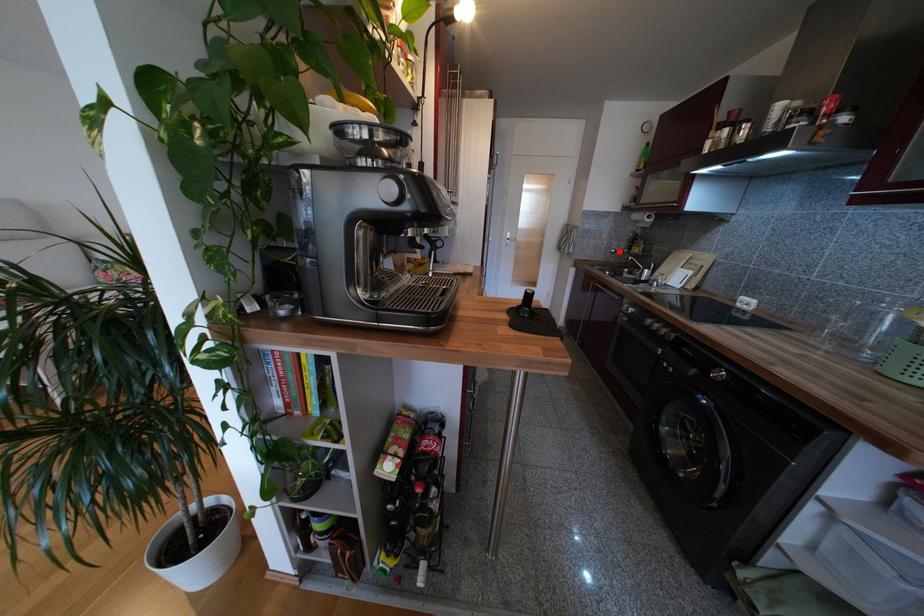
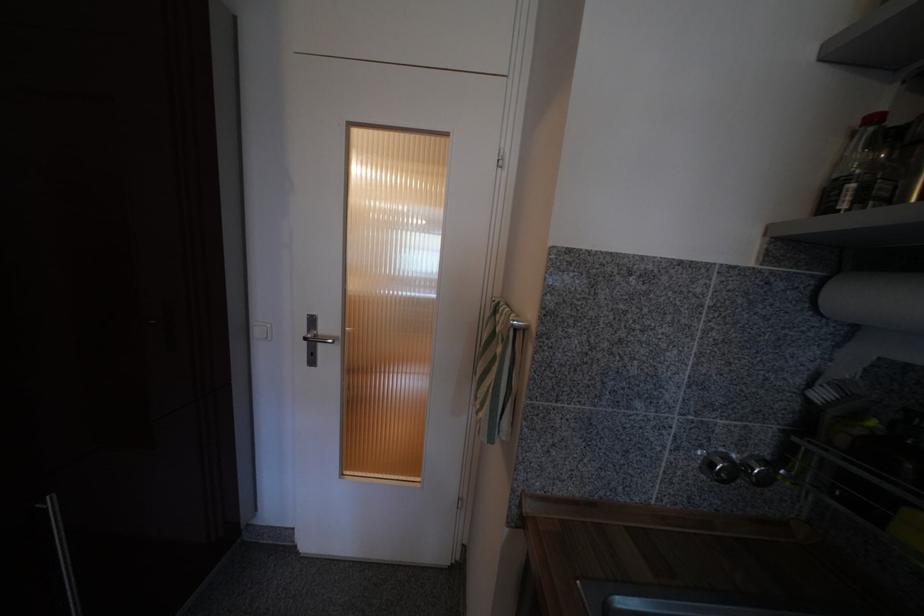
Question: A red point is marked in image1. In image2, is the corresponding 3D point closer to the camera or farther? Reply with the corresponding letter.

Choices:
 (A) The corresponding 3D point is closer.
 (B) The corresponding 3D point is farther.

Answer: (B)